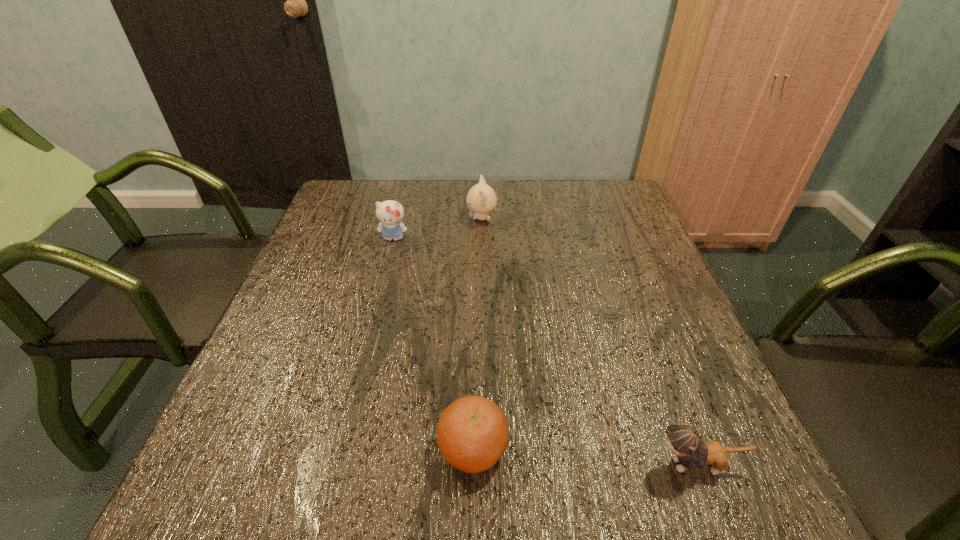
Where is `vacant area that satisfies the following two spatial constraints: 1. on the face of the farthest kitten; 2. on the front-facing side of the leftmost object`? vacant area that satisfies the following two spatial constraints: 1. on the face of the farthest kitten; 2. on the front-facing side of the leftmost object is located at coordinates (482, 238).

Find the location of a particular element. vacant region that satisfies the following two spatial constraints: 1. on the face of the farthest kitten; 2. on the front side of the clementine is located at coordinates (483, 448).

At what (x,y) coordinates should I click in order to perform the action: click on vacant position in the image that satisfies the following two spatial constraints: 1. on the face of the farthest object; 2. on the front side of the clementine. Please return your answer as a coordinate pair (x, y). This screenshot has width=960, height=540. Looking at the image, I should click on (483, 448).